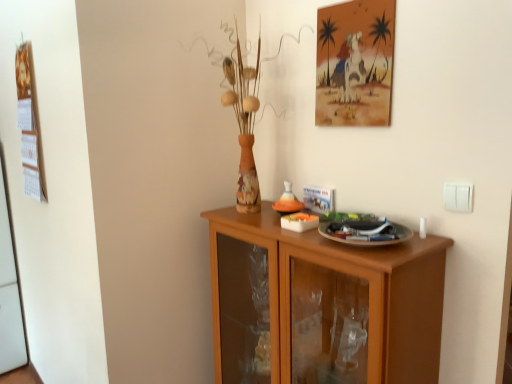
Question: From a real-world perspective, does wooden calendar at left, which ranks as the 1th picture frame in back-to-front order, stand above white plastic switch at upper right?

Choices:
 (A) yes
 (B) no

Answer: (A)

Question: Does wooden calendar at left, which is the 2th picture frame in front-to-back order, come in front of white plastic switch at upper right?

Choices:
 (A) yes
 (B) no

Answer: (B)

Question: Does wooden calendar at left, which ranks as the 1th picture frame in back-to-front order, have a greater width compared to white plastic switch at upper right?

Choices:
 (A) no
 (B) yes

Answer: (B)

Question: From the image's perspective, is wooden calendar at left, which is counted as the 1th picture frame, starting from the left, above white plastic switch at upper right?

Choices:
 (A) yes
 (B) no

Answer: (A)

Question: Is wooden calendar at left, which is counted as the 1th picture frame, starting from the left, to the right of white plastic switch at upper right from the viewer's perspective?

Choices:
 (A) yes
 (B) no

Answer: (B)

Question: Is brown wooden cabinet at center to the left or to the right of watercolor paper painting at upper center, which is the 1th picture frame in front-to-back order, in the image?

Choices:
 (A) right
 (B) left

Answer: (B)

Question: Looking at their shapes, would you say brown wooden cabinet at center is wider or thinner than watercolor paper painting at upper center, the 1th picture frame viewed from the right?

Choices:
 (A) thin
 (B) wide

Answer: (B)

Question: Considering their positions, is brown wooden cabinet at center located in front of or behind watercolor paper painting at upper center, which is the 1th picture frame in front-to-back order?

Choices:
 (A) behind
 (B) front

Answer: (B)

Question: From the image's perspective, is brown wooden cabinet at center located above or below watercolor paper painting at upper center, which is the 1th picture frame in front-to-back order?

Choices:
 (A) above
 (B) below

Answer: (B)

Question: From a real-world perspective, is brown wooden cabinet at center physically located above or below white plastic switch at upper right?

Choices:
 (A) above
 (B) below

Answer: (B)

Question: Is brown wooden cabinet at center spatially inside white plastic switch at upper right, or outside of it?

Choices:
 (A) inside
 (B) outside

Answer: (B)

Question: From the image's perspective, is brown wooden cabinet at center above or below white plastic switch at upper right?

Choices:
 (A) below
 (B) above

Answer: (A)

Question: Looking at their shapes, would you say brown wooden cabinet at center is wider or thinner than white plastic switch at upper right?

Choices:
 (A) wide
 (B) thin

Answer: (A)

Question: Considering the positions of point (28, 57) and point (382, 254), is point (28, 57) closer or farther from the camera than point (382, 254)?

Choices:
 (A) closer
 (B) farther

Answer: (B)

Question: Based on their positions, is wooden calendar at left, which ranks as the 1th picture frame in back-to-front order, located to the left or right of brown wooden cabinet at center?

Choices:
 (A) left
 (B) right

Answer: (A)